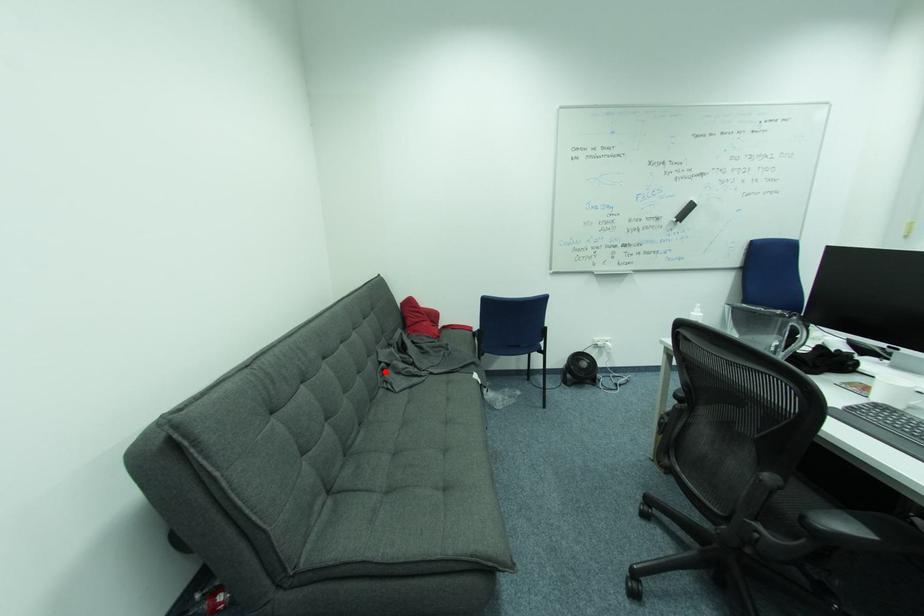
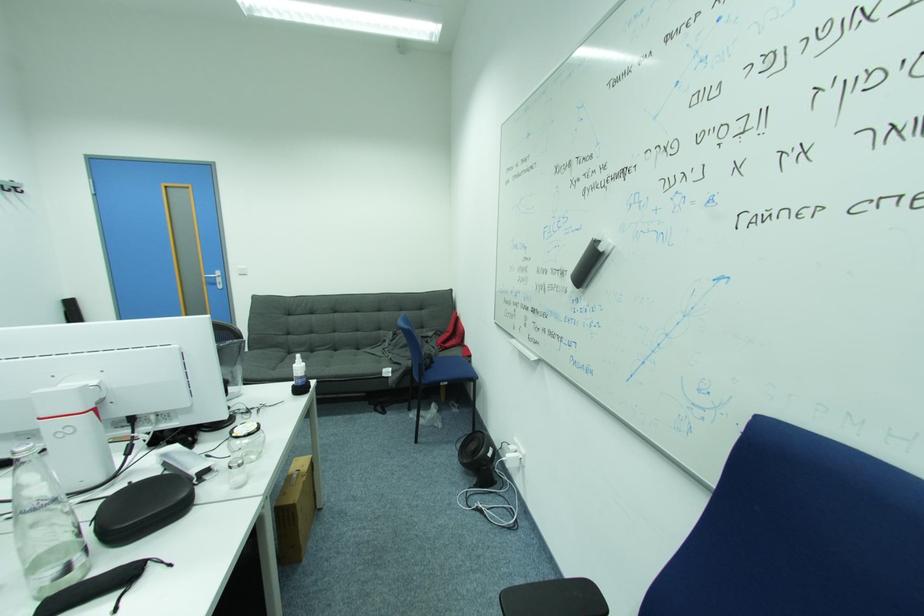
Question: I am providing you with two images of the same scene from different viewpoints. Given a red point in image1, look at the same physical point in image2. Is it:

Choices:
 (A) Closer to the viewpoint
 (B) Farther from the viewpoint

Answer: (B)